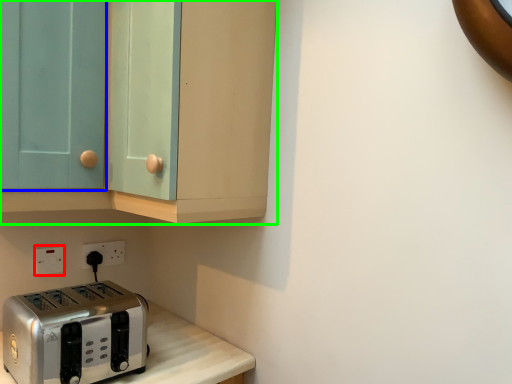
Question: Which object is the closest to the electric outlet (highlighted by a red box)? Choose among these: glass door (highlighted by a blue box) or cabinetry (highlighted by a green box).

Choices:
 (A) glass door
 (B) cabinetry

Answer: (A)